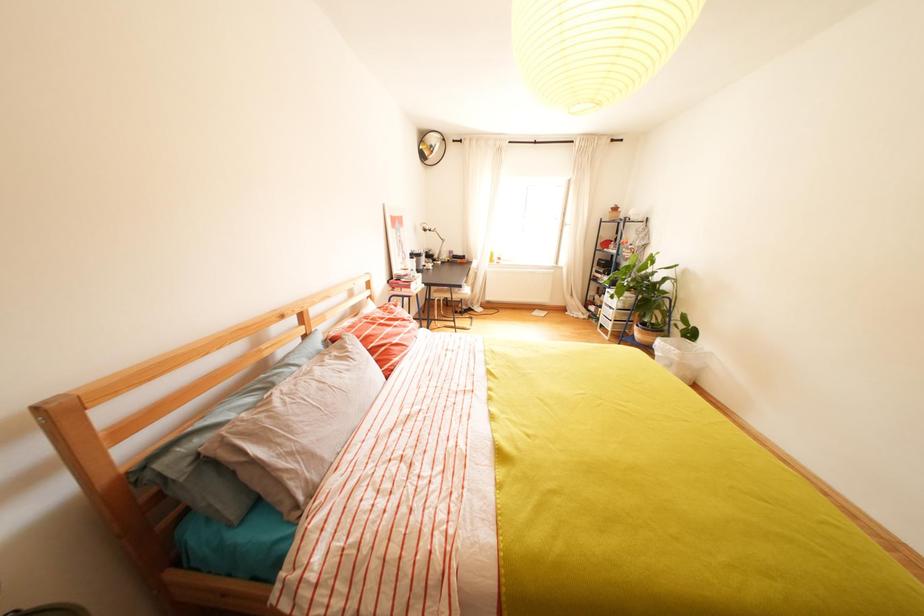
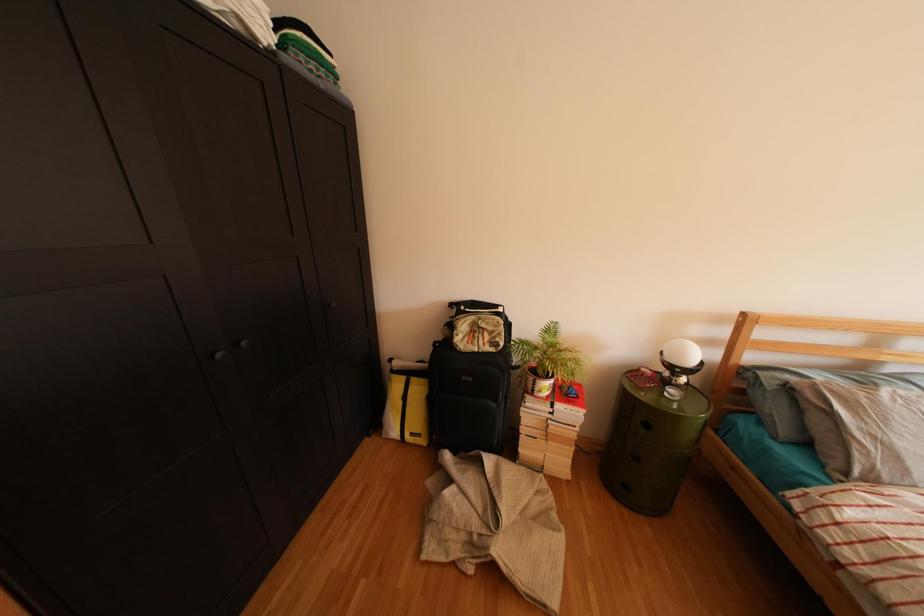
Based on the continuous images, in which direction is the camera rotating?

The camera's rotation is toward left-down.